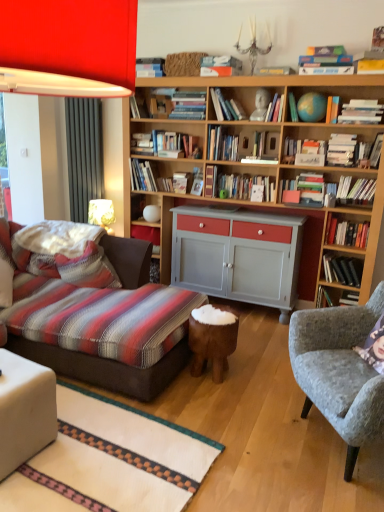
Question: From a real-world perspective, is hardcover book at upper right, acting as the 16th book starting from the left, positioned under hardcover book at upper center, which is the seventh book in left-to-right order, based on gravity?

Choices:
 (A) yes
 (B) no

Answer: (A)

Question: Does hardcover book at upper right, acting as the 16th book starting from the left, turn towards hardcover book at upper center, which is the seventh book in left-to-right order?

Choices:
 (A) no
 (B) yes

Answer: (A)

Question: Considering the relative sizes of hardcover book at upper right, acting as the 16th book starting from the left, and hardcover book at upper center, which is the seventh book in left-to-right order, in the image provided, is hardcover book at upper right, acting as the 16th book starting from the left, taller than hardcover book at upper center, which is the seventh book in left-to-right order,?

Choices:
 (A) no
 (B) yes

Answer: (A)

Question: Is hardcover book at upper center, the 14th book in the right-to-left sequence, inside hardcover book at upper right, which appears as the fifth book when viewed from the right?

Choices:
 (A) yes
 (B) no

Answer: (B)

Question: From the image's perspective, is hardcover book at upper right, acting as the 16th book starting from the left, beneath hardcover book at upper center, which is the seventh book in left-to-right order?

Choices:
 (A) yes
 (B) no

Answer: (A)

Question: Is hardcover book at upper right, which appears as the fifth book when viewed from the right, thinner than hardcover book at upper center, the 14th book in the right-to-left sequence?

Choices:
 (A) no
 (B) yes

Answer: (B)

Question: Considering the relative sizes of hardcover book at upper right, the tenth book when ordered from left to right, and striped fabric pillow at lower left in the image provided, is hardcover book at upper right, the tenth book when ordered from left to right, shorter than striped fabric pillow at lower left?

Choices:
 (A) yes
 (B) no

Answer: (A)

Question: Is hardcover book at upper right, the tenth book when ordered from left to right, facing away from striped fabric pillow at lower left?

Choices:
 (A) no
 (B) yes

Answer: (A)

Question: Can you confirm if hardcover book at upper right, acting as the eleventh book starting from the right, is bigger than striped fabric pillow at lower left?

Choices:
 (A) no
 (B) yes

Answer: (A)

Question: Is hardcover book at upper right, acting as the eleventh book starting from the right, with striped fabric pillow at lower left?

Choices:
 (A) yes
 (B) no

Answer: (B)

Question: Is hardcover book at upper right, the tenth book when ordered from left to right, facing towards striped fabric pillow at lower left?

Choices:
 (A) yes
 (B) no

Answer: (B)

Question: Would you consider hardcover book at upper right, the tenth book when ordered from left to right, to be distant from striped fabric pillow at lower left?

Choices:
 (A) no
 (B) yes

Answer: (B)

Question: Does hardcover books at upper right, which is the 9th book from right to left, have a greater height compared to hardcover book at center, which is the 2th book in left-to-right order?

Choices:
 (A) yes
 (B) no

Answer: (B)